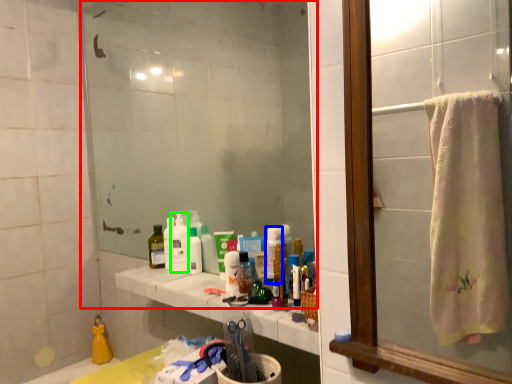
Question: Based on their relative distances, which object is nearer to mirror (highlighted by a red box)? Choose from cleaning product (highlighted by a blue box) and cleaning product (highlighted by a green box).

Choices:
 (A) cleaning product
 (B) cleaning product

Answer: (B)